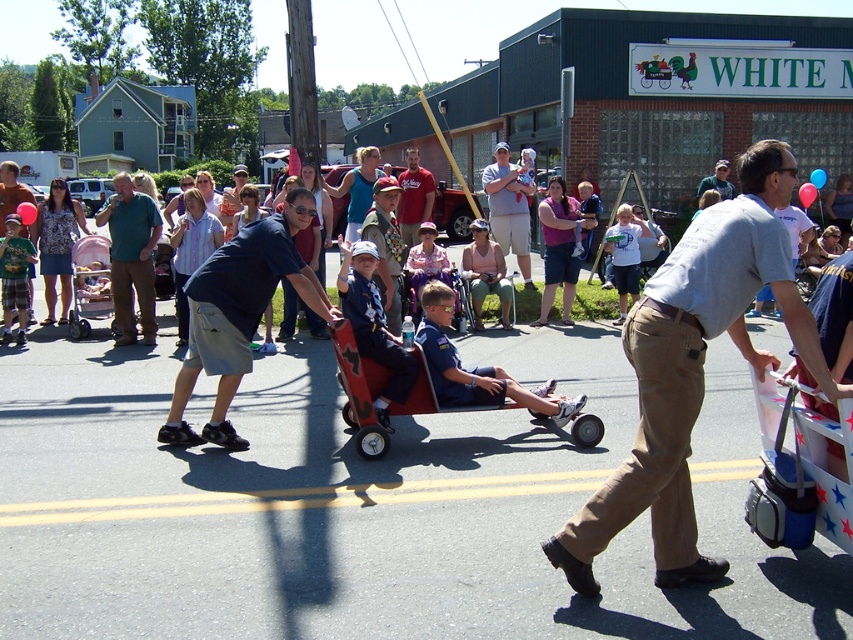
Question: Can you confirm if khaki pants at center is wider than matte gray shirt at center?

Choices:
 (A) no
 (B) yes

Answer: (B)

Question: Is dark blue shorts at center below pink fabric baby carriage at left?

Choices:
 (A) yes
 (B) no

Answer: (A)

Question: Does khaki pants at center have a greater width compared to green t-shirt at center?

Choices:
 (A) no
 (B) yes

Answer: (B)

Question: Which of the following is the closest to the observer?

Choices:
 (A) (105, 282)
 (B) (525, 269)
 (C) (724, 163)
 (D) (120, 307)

Answer: (D)

Question: Which of the following is the closest to the observer?

Choices:
 (A) (115, 304)
 (B) (495, 397)
 (C) (260, 307)

Answer: (C)

Question: Which object is positioned farthest from the khaki pants at center?

Choices:
 (A) wooden cart at center
 (B) green matte shirt at center
 (C) matte gray shirt at center
 (D) matte red shirt at center

Answer: (C)